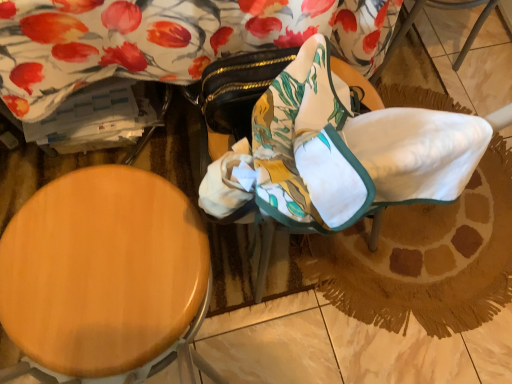
Locate an element on the screen. The image size is (512, 384). floral fabric swivel chair at center is located at coordinates (342, 152).

What do you see at coordinates (342, 152) in the screenshot? I see `floral fabric swivel chair at center` at bounding box center [342, 152].

This screenshot has height=384, width=512. Describe the element at coordinates (105, 279) in the screenshot. I see `wooden stool at left` at that location.

Find the location of a particular element. This screenshot has width=512, height=384. wooden stool at left is located at coordinates (105, 279).

Measure the distance between wooden stool at left and camera.

A distance of 25.85 inches exists between wooden stool at left and camera.

I want to click on floral fabric swivel chair at center, so click(342, 152).

Can you confirm if floral fabric swivel chair at center is positioned to the left of wooden stool at left?

No.

Based on the photo, which is in front, floral fabric swivel chair at center or wooden stool at left?

wooden stool at left.

Which is closer to the camera, [272,106] or [79,355]?

Clearly, point [272,106] is closer to the camera than point [79,355].

From the image's perspective, is floral fabric swivel chair at center located above or below wooden stool at left?

From the image's perspective, floral fabric swivel chair at center appears above wooden stool at left.

From a real-world perspective, is floral fabric swivel chair at center physically located above or below wooden stool at left?

floral fabric swivel chair at center is situated higher than wooden stool at left in the real world.

Based on the photo, is floral fabric swivel chair at center thinner than wooden stool at left?

Yes.

Between floral fabric swivel chair at center and wooden stool at left, which one has more height?

With more height is wooden stool at left.

From the picture: Considering the relative sizes of floral fabric swivel chair at center and wooden stool at left in the image provided, is floral fabric swivel chair at center smaller than wooden stool at left?

Yes, floral fabric swivel chair at center is smaller than wooden stool at left.

Do you think floral fabric swivel chair at center is within wooden stool at left, or outside of it?

floral fabric swivel chair at center is not enclosed by wooden stool at left.

Is floral fabric swivel chair at center directly adjacent to wooden stool at left?

No, floral fabric swivel chair at center is not in contact with wooden stool at left.

Is floral fabric swivel chair at center looking in the opposite direction of wooden stool at left?

No, floral fabric swivel chair at center is not facing away from wooden stool at left.

Locate an element on the screen. swivel chair on the right of wooden stool at left is located at coordinates (342, 152).

Can you confirm if wooden stool at left is positioned to the right of floral fabric swivel chair at center?

Incorrect, wooden stool at left is not on the right side of floral fabric swivel chair at center.

Is wooden stool at left closer to camera compared to floral fabric swivel chair at center?

Yes, it is in front of floral fabric swivel chair at center.

Which is farther from the camera, [47,330] or [296,184]?

The point [47,330] is behind.

From the image's perspective, which object appears higher, wooden stool at left or floral fabric swivel chair at center?

floral fabric swivel chair at center is shown above in the image.

From a real-world perspective, does wooden stool at left sit lower than floral fabric swivel chair at center?

Yes, from a real-world perspective, wooden stool at left is beneath floral fabric swivel chair at center.

Between wooden stool at left and floral fabric swivel chair at center, which one has larger width?

wooden stool at left is wider.

Is wooden stool at left taller than floral fabric swivel chair at center?

Yes.

From the picture: Considering the sizes of objects wooden stool at left and floral fabric swivel chair at center in the image provided, who is smaller, wooden stool at left or floral fabric swivel chair at center?

Smaller between the two is floral fabric swivel chair at center.

Is wooden stool at left positioned beyond the bounds of floral fabric swivel chair at center?

That's correct, wooden stool at left is outside of floral fabric swivel chair at center.

Is wooden stool at left beside floral fabric swivel chair at center?

wooden stool at left is not next to floral fabric swivel chair at center, and they're not touching.

Is wooden stool at left oriented away from floral fabric swivel chair at center?

No, wooden stool at left is not facing the opposite direction of floral fabric swivel chair at center.

What's the angular difference between wooden stool at left and floral fabric swivel chair at center's facing directions?

There is a 15.3-degree angle between the facing directions of wooden stool at left and floral fabric swivel chair at center.

Find the location of a particular element. The image size is (512, 384). swivel chair above the wooden stool at left (from the image's perspective) is located at coordinates (342, 152).

You are a GUI agent. You are given a task and a screenshot of the screen. Output one action in this format:
    pyautogui.click(x=<x>, y=<y>)
    Task: Click on the furniture that appears below the floral fabric swivel chair at center (from a real-world perspective)
    The width and height of the screenshot is (512, 384).
    Given the screenshot: What is the action you would take?
    pyautogui.click(x=105, y=279)

Locate an element on the screen. The width and height of the screenshot is (512, 384). swivel chair located on the right of wooden stool at left is located at coordinates (342, 152).